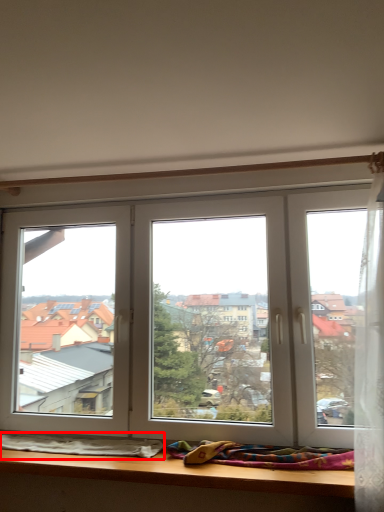
Question: From the image's perspective, what is the correct spatial relationship of blanket (annotated by the red box) in relation to blanket?

Choices:
 (A) above
 (B) below

Answer: (B)